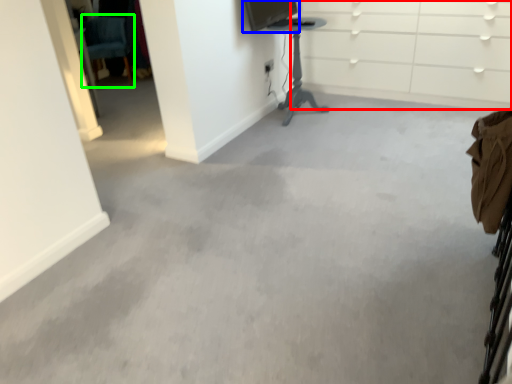
Question: Estimate the real-world distances between objects in this image. Which object is farther from dresser (highlighted by a red box), computer monitor (highlighted by a blue box) or swivel chair (highlighted by a green box)?

Choices:
 (A) computer monitor
 (B) swivel chair

Answer: (B)